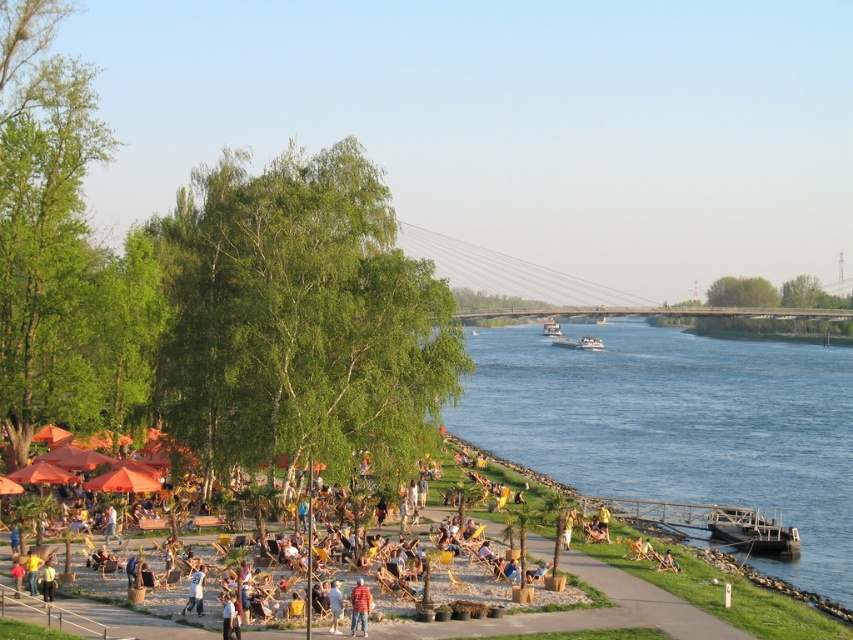
Is striped shirt at lower center smaller than white cotton shirt at center?

Yes, striped shirt at lower center is smaller than white cotton shirt at center.

Between point (360, 627) and point (331, 596), which one is positioned behind?

The point (331, 596) is behind.

The image size is (853, 640). In order to click on striped shirt at lower center in this screenshot , I will do `click(358, 605)`.

Is blue water at center bigger than white cotton shirt at center?

→ Correct, blue water at center is larger in size than white cotton shirt at center.

Between point (824, 515) and point (329, 612), which one is positioned in front?

Point (329, 612)

This screenshot has height=640, width=853. I want to click on blue water at center, so point(677,426).

Is blue water at center thinner than striped shirt at lower center?

No, blue water at center is not thinner than striped shirt at lower center.

Is blue water at center smaller than striped shirt at lower center?

Incorrect, blue water at center is not smaller in size than striped shirt at lower center.

Between point (747, 467) and point (352, 630), which one is positioned behind?

Point (747, 467)

In order to click on blue water at center in this screenshot , I will do `click(677, 426)`.